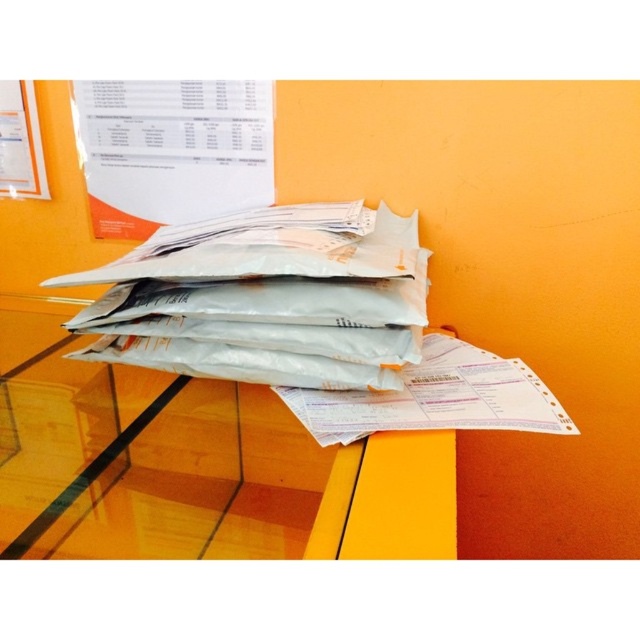
Question: Where is transparent glass table at center located in relation to white matte envelopes at center in the image?

Choices:
 (A) below
 (B) above

Answer: (A)

Question: Which point is closer to the camera?

Choices:
 (A) (156, 388)
 (B) (412, 214)

Answer: (A)

Question: Which of these objects is positioned farthest from the transparent glass table at center?

Choices:
 (A) white matte envelopes at center
 (B) white paper at center

Answer: (B)

Question: Can you confirm if white matte envelopes at center is bigger than white paper at center?

Choices:
 (A) yes
 (B) no

Answer: (A)

Question: Which point is closer to the camera?

Choices:
 (A) white matte envelopes at center
 (B) white paper at center
 (C) transparent glass table at center

Answer: (C)

Question: Does transparent glass table at center appear on the left side of white matte envelopes at center?

Choices:
 (A) no
 (B) yes

Answer: (B)